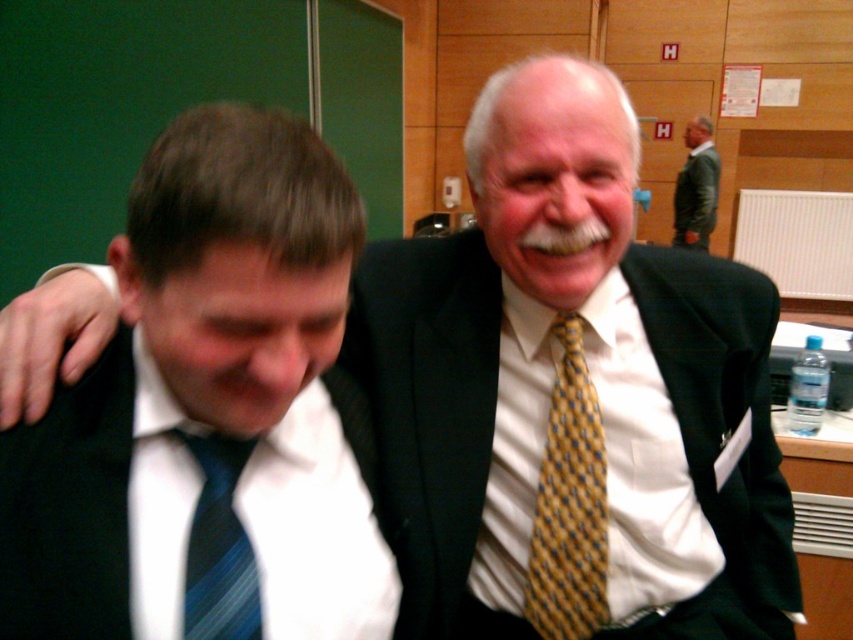
You are a photographer adjusting your camera settings. You notice the matte black suit at left and the blue striped tie at left in the frame. Which object should appear larger in your photo due to its proximity to the camera?

The matte black suit at left appears larger because it is closer to the viewer than the blue striped tie at left.

You are a photographer trying to capture a candid shot of the two people in the scene. Since the matte black suit at left and the yellow dotted tie at center are in your viewfinder, which one is closer to the camera?

The matte black suit at left is closer to the camera because it is in front of the yellow dotted tie at center.